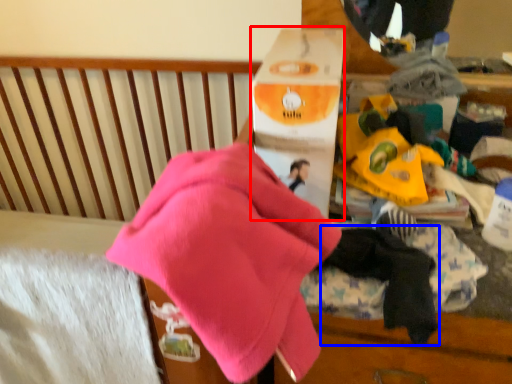
Question: Which object appears farthest to the camera in this image, cardboard box (highlighted by a red box) or baby clothe (highlighted by a blue box)?

Choices:
 (A) cardboard box
 (B) baby clothe

Answer: (A)